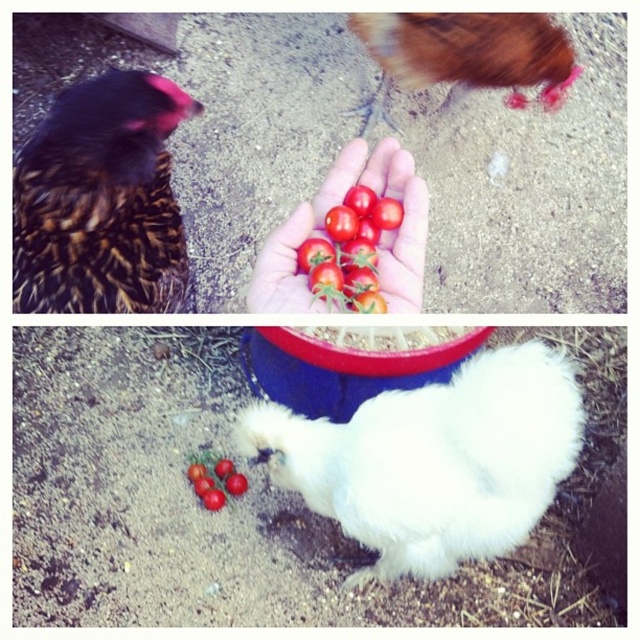
Question: Based on their relative distances, which object is farther from the glossy cherry tomatoes at center?

Choices:
 (A) brown fluffy chicken at upper center
 (B) glossy cherry tomato at lower center
 (C) brown speckled feathers at left

Answer: (A)

Question: Does red matte tomatoes at center appear over glossy cherry tomato at lower center?

Choices:
 (A) yes
 (B) no

Answer: (A)

Question: Estimate the real-world distances between objects in this image. Which object is closer to the red matte tomatoes at center?

Choices:
 (A) glossy cherry tomato at lower center
 (B) brown speckled feathers at left

Answer: (B)

Question: Does brown speckled feathers at left appear on the right side of glossy cherry tomato at lower center?

Choices:
 (A) yes
 (B) no

Answer: (B)

Question: Is brown fluffy chicken at upper center below glossy cherry tomato at lower center?

Choices:
 (A) no
 (B) yes

Answer: (A)

Question: Which object is farther from the camera taking this photo?

Choices:
 (A) red matte tomatoes at center
 (B) brown speckled feathers at left

Answer: (B)